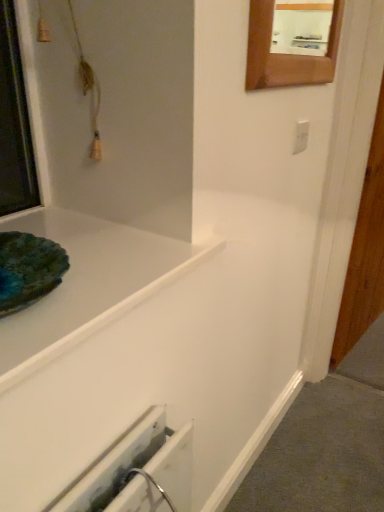
This screenshot has height=512, width=384. Identify the location of free space above white glossy bathtub at upper left (from a real-world perspective). 93,253.